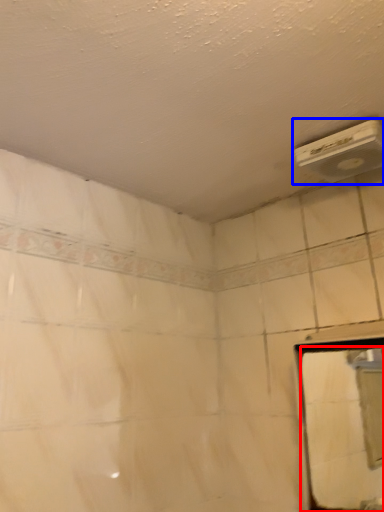
Question: Which point is further to the camera, mirror (highlighted by a red box) or air conditioning (highlighted by a blue box)?

Choices:
 (A) mirror
 (B) air conditioning

Answer: (B)